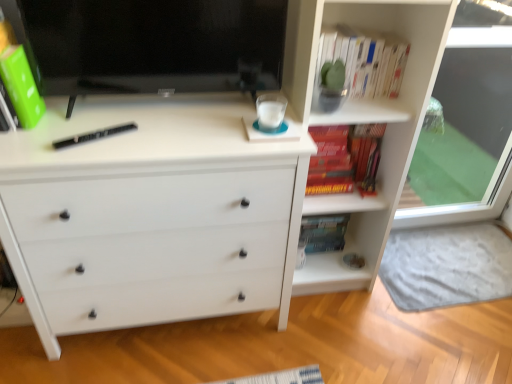
Question: Considering the relative sizes of transparent glass door at right and white matte chest of drawers at center in the image provided, is transparent glass door at right bigger than white matte chest of drawers at center?

Choices:
 (A) yes
 (B) no

Answer: (B)

Question: Could you tell me if transparent glass door at right is turned towards white matte chest of drawers at center?

Choices:
 (A) no
 (B) yes

Answer: (A)

Question: Is transparent glass door at right to the right of white matte chest of drawers at center from the viewer's perspective?

Choices:
 (A) yes
 (B) no

Answer: (A)

Question: Is white matte chest of drawers at center surrounded by transparent glass door at right?

Choices:
 (A) yes
 (B) no

Answer: (B)

Question: From the image's perspective, is transparent glass door at right above white matte chest of drawers at center?

Choices:
 (A) no
 (B) yes

Answer: (B)

Question: Is transparent glass door at right far away from white matte chest of drawers at center?

Choices:
 (A) no
 (B) yes

Answer: (B)

Question: Is transparent glass door at right closer to the viewer compared to hardcover book at center-right, which is the first paperback book in right-to-left order?

Choices:
 (A) no
 (B) yes

Answer: (B)

Question: Does transparent glass door at right have a greater width compared to hardcover book at center-right, acting as the second paperback book starting from the left?

Choices:
 (A) yes
 (B) no

Answer: (B)

Question: Can you confirm if transparent glass door at right is smaller than hardcover book at center-right, which is the 2th paperback book in front-to-back order?

Choices:
 (A) yes
 (B) no

Answer: (B)

Question: Is transparent glass door at right taller than hardcover book at center-right, acting as the second paperback book starting from the left?

Choices:
 (A) yes
 (B) no

Answer: (A)

Question: From a real-world perspective, is transparent glass door at right over hardcover book at center-right, which is the 2th paperback book in front-to-back order?

Choices:
 (A) yes
 (B) no

Answer: (A)

Question: Is transparent glass door at right shorter than hardcover book at center-right, which is the 2th paperback book in front-to-back order?

Choices:
 (A) yes
 (B) no

Answer: (B)

Question: From the image's perspective, is black hardback book at center on hardcover book at upper right, acting as the second book starting from the top?

Choices:
 (A) no
 (B) yes

Answer: (A)